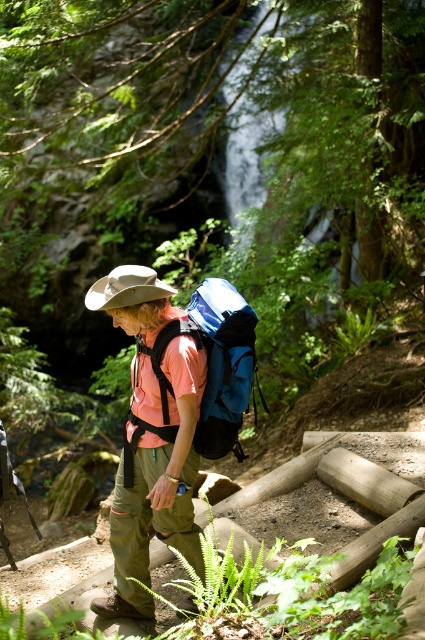
Question: Considering the relative positions of blue fabric backpack at center and tan fabric hat at center in the image provided, where is blue fabric backpack at center located with respect to tan fabric hat at center?

Choices:
 (A) below
 (B) above

Answer: (A)

Question: Which point appears farthest from the camera in this image?

Choices:
 (A) (187, 397)
 (B) (244, 380)

Answer: (B)

Question: Is matte pink shirt at center wider than blue fabric backpack at center?

Choices:
 (A) no
 (B) yes

Answer: (A)

Question: Observing the image, what is the correct spatial positioning of matte pink shirt at center in reference to tan fabric hat at center?

Choices:
 (A) left
 (B) right

Answer: (B)

Question: Estimate the real-world distances between objects in this image. Which object is farther from the blue fabric backpack at center?

Choices:
 (A) matte pink shirt at center
 (B) tan fabric hat at center

Answer: (B)

Question: Which of the following is the closest to the observer?

Choices:
 (A) (206, 419)
 (B) (90, 301)

Answer: (A)